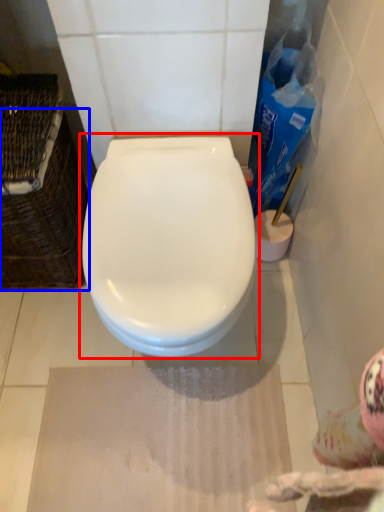
Question: Which of the following is the farthest to the observer, toilet (highlighted by a red box) or basket (highlighted by a blue box)?

Choices:
 (A) toilet
 (B) basket

Answer: (B)